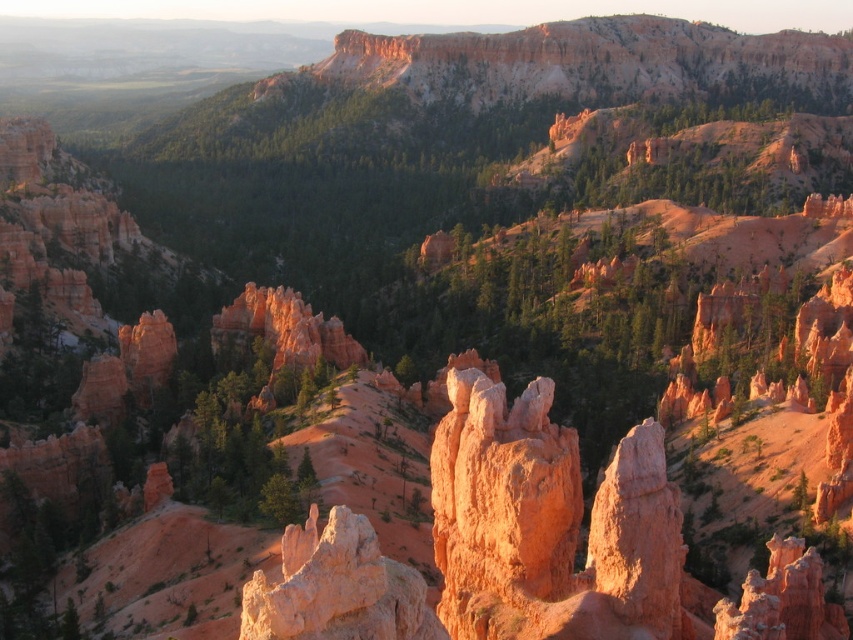
Which is more to the left, rustic sandstone spires at center or rustic sandstone spire at center?

Positioned to the left is rustic sandstone spire at center.

What are the coordinates of `rustic sandstone spires at center` in the screenshot? It's located at [x=548, y=524].

You are a GUI agent. You are given a task and a screenshot of the screen. Output one action in this format:
    pyautogui.click(x=<x>, y=<y>)
    Task: Click on the rustic sandstone spires at center
    
    Given the screenshot: What is the action you would take?
    548,524